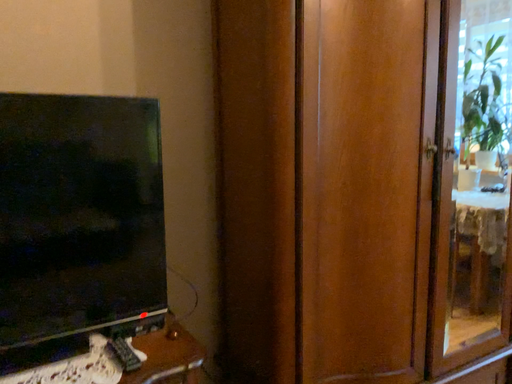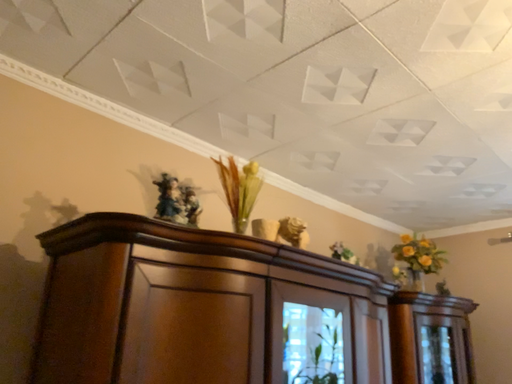
Question: Which way did the camera rotate in the video?

Choices:
 (A) rotated right
 (B) rotated left

Answer: (A)